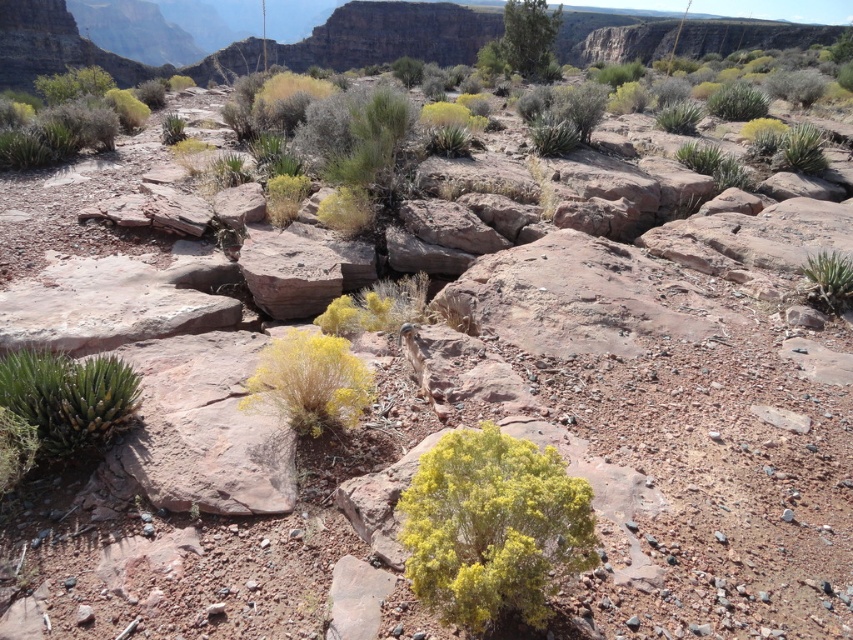
Question: Which object is the closest to the green leafy tree at upper right?

Choices:
 (A) green fuzzy plant at right
 (B) green succulent at lower left

Answer: (A)

Question: Which point is closer to the camera?

Choices:
 (A) (511, 51)
 (B) (492, 474)
 (C) (22, 392)
 (D) (820, 288)

Answer: (B)

Question: Where is yellow fluffy bush at center located in relation to green fuzzy plant at right in the image?

Choices:
 (A) left
 (B) right

Answer: (A)

Question: From the image, what is the correct spatial relationship of green leafy tree at upper right in relation to green fuzzy plant at right?

Choices:
 (A) above
 (B) below

Answer: (A)

Question: Based on their relative distances, which object is farther from the green fuzzy plant at right?

Choices:
 (A) green succulent at lower left
 (B) yellow fluffy bush at center

Answer: (A)

Question: Where is yellow fluffy bush at center located in relation to green leafy tree at upper right in the image?

Choices:
 (A) below
 (B) above

Answer: (A)